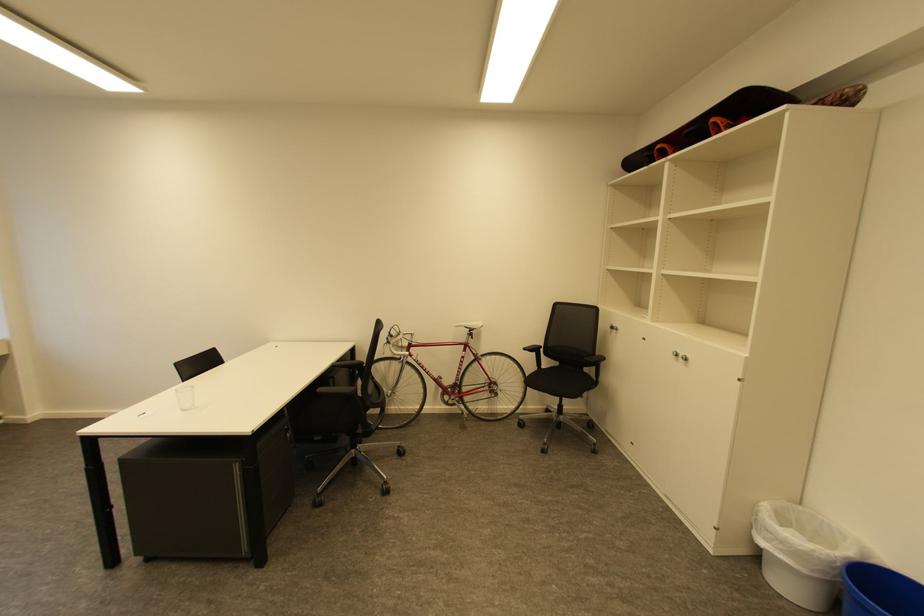
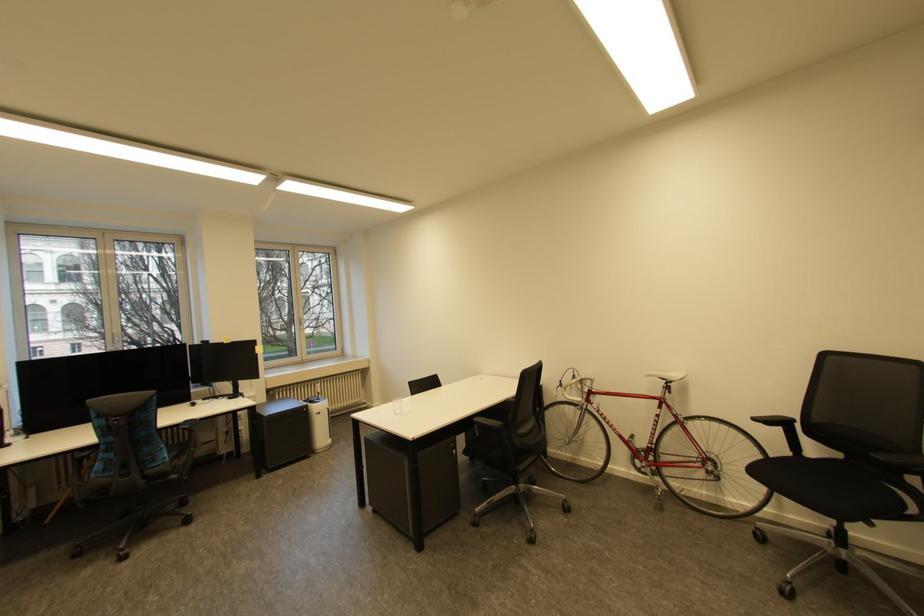
Question: The first image is from the beginning of the video and the second image is from the end. How did the camera likely rotate when shooting the video?

Choices:
 (A) Left
 (B) Right
 (C) Up
 (D) Down

Answer: (A)